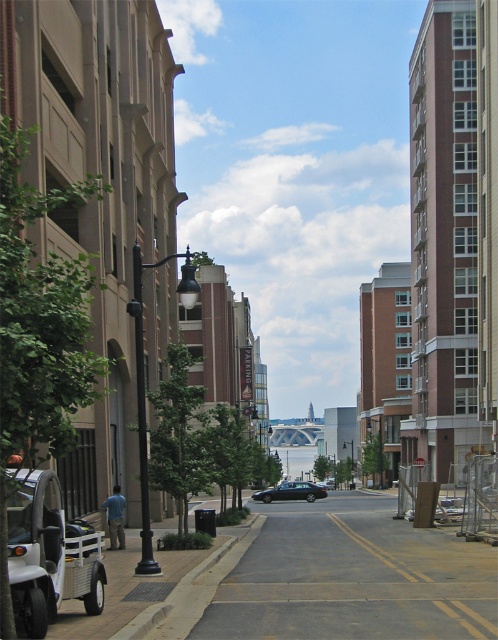
Is gray asphalt road at center to the left of shiny black sedan at center from the viewer's perspective?

Yes, gray asphalt road at center is to the left of shiny black sedan at center.

Which is in front, point (314, 616) or point (322, 488)?

Point (314, 616) is in front.

Find the location of `gray asphalt road at center`. gray asphalt road at center is located at coordinates (353, 577).